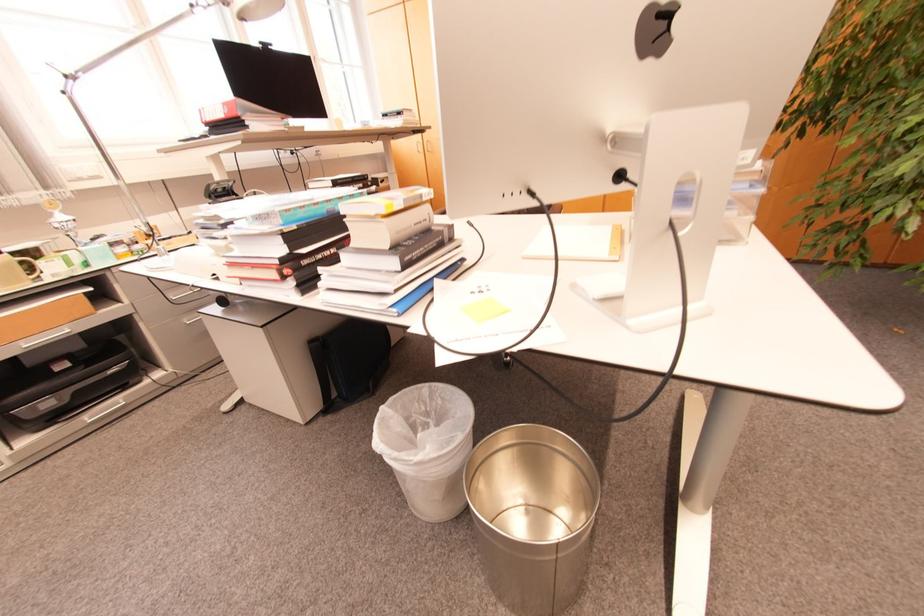
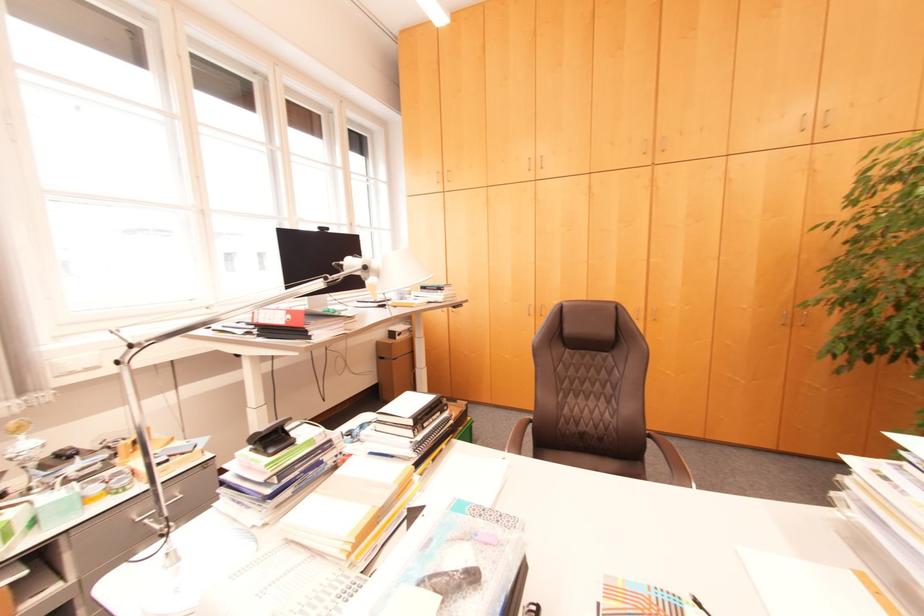
Which direction would the cameraman need to move to produce the second image?

The cameraman moved toward left, forward.